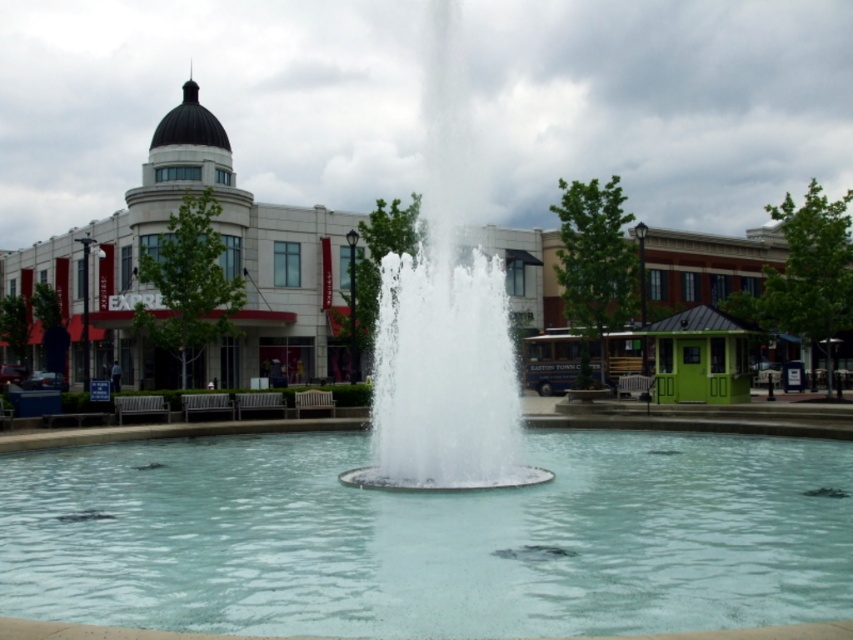
From the picture: You are standing in the urban plaza and want to locate the clear glass pool at center. Based on the coordinates provided, where should you look to find it?

The clear glass pool at center is located at point coordinates (430, 538).

You are designing a safety plan for the plaza and need to ensure that the clear glass pool at center and the clear water fountain at center are accessible to visitors. Considering their widths, which one has a larger footprint and should be marked with a wider safety zone?

The clear glass pool at center has a larger footprint than the clear water fountain at center, so it should be marked with a wider safety zone.

You are standing in the urban plaza and want to take a photo of the clear glass pool at center and the clear water fountain at center. Since you want both in the frame, which object should you position closer to you to ensure both are visible?

To ensure both the clear glass pool at center and the clear water fountain at center are visible in the photo, position yourself closer to the clear glass pool at center since it is to the left of the clear water fountain at center.